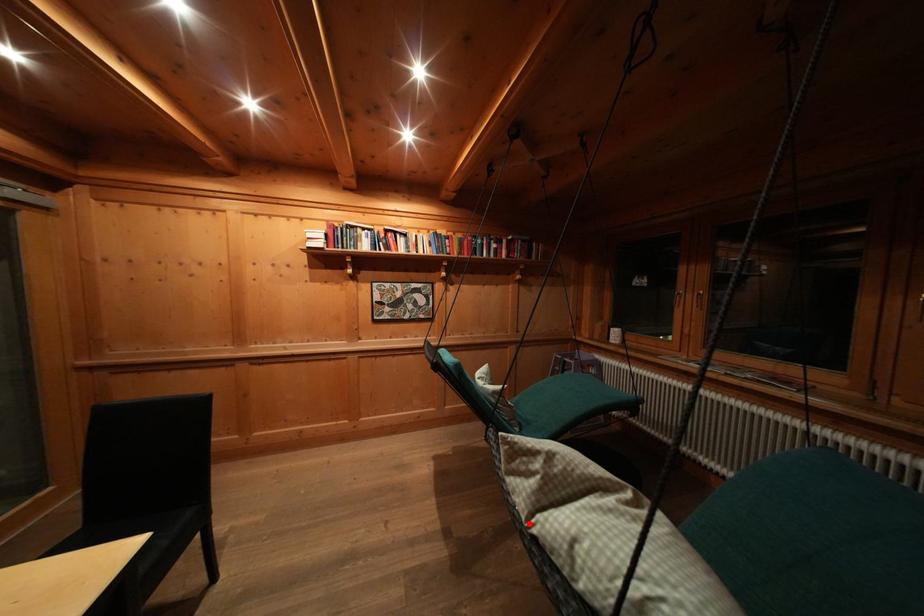
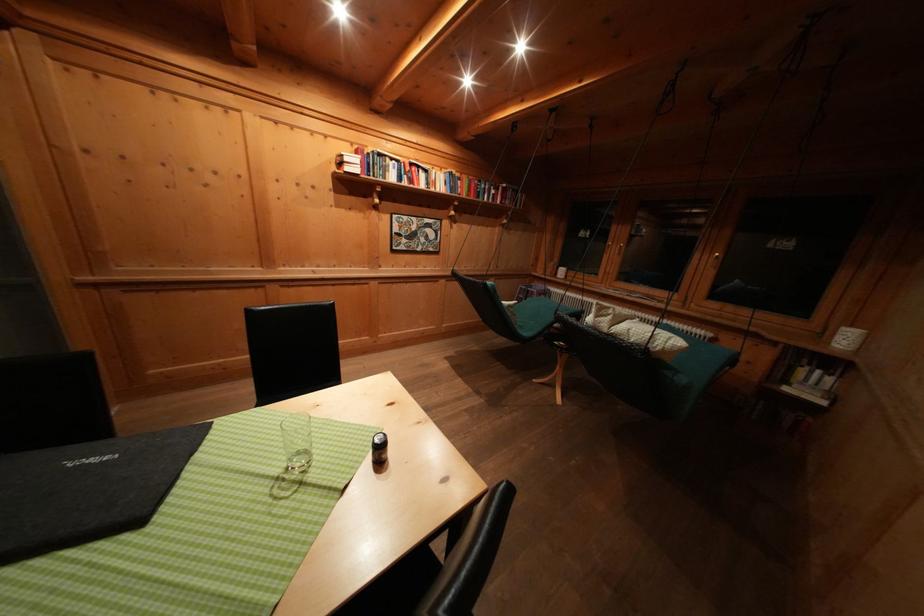
In the second image, find the point that corresponds to the highlighted location in the first image.

(612, 334)